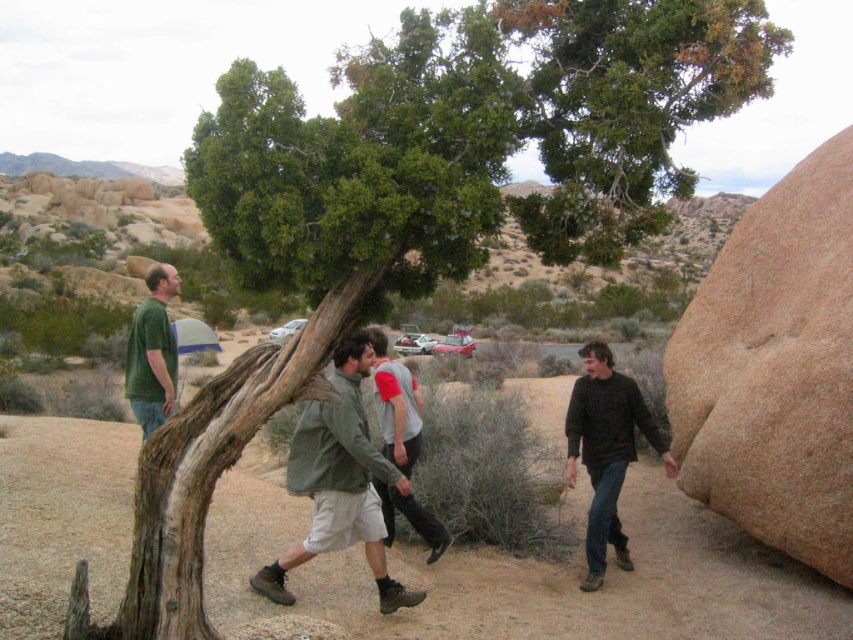
You are part of a hiking group in the desert and want to take a photo of the brown rough rock at right and the green matte shirt at center. Which object should you focus on first if you want both to be in clear focus?

The brown rough rock at right is in front of the green matte shirt at center, so you should focus on the brown rough rock at right first to ensure both are in clear focus.